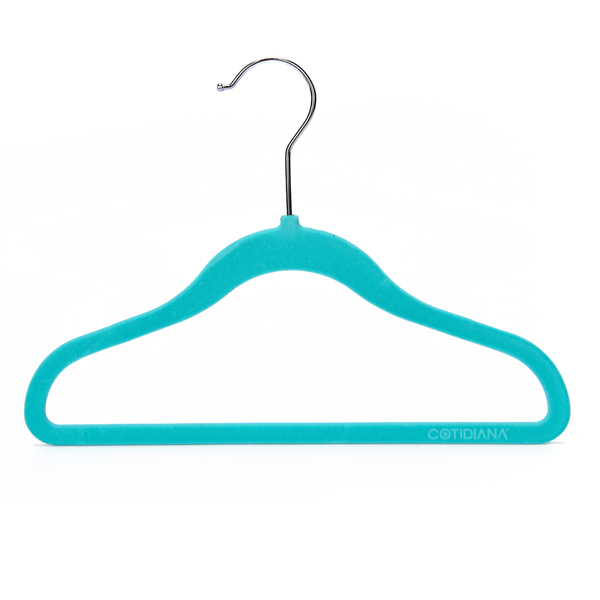
The height and width of the screenshot is (600, 600). Identify the location of clear space to the upper right of hanger. (444, 165).